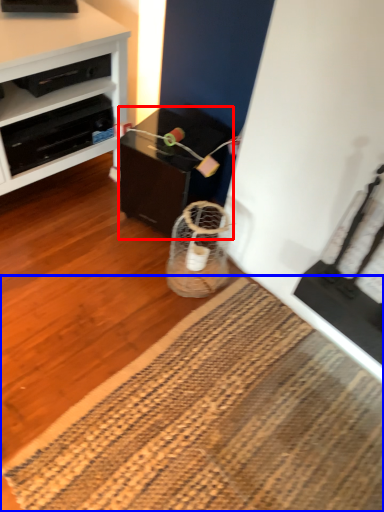
Question: Which point is closer to the camera, table (highlighted by a red box) or mat (highlighted by a blue box)?

Choices:
 (A) table
 (B) mat

Answer: (B)